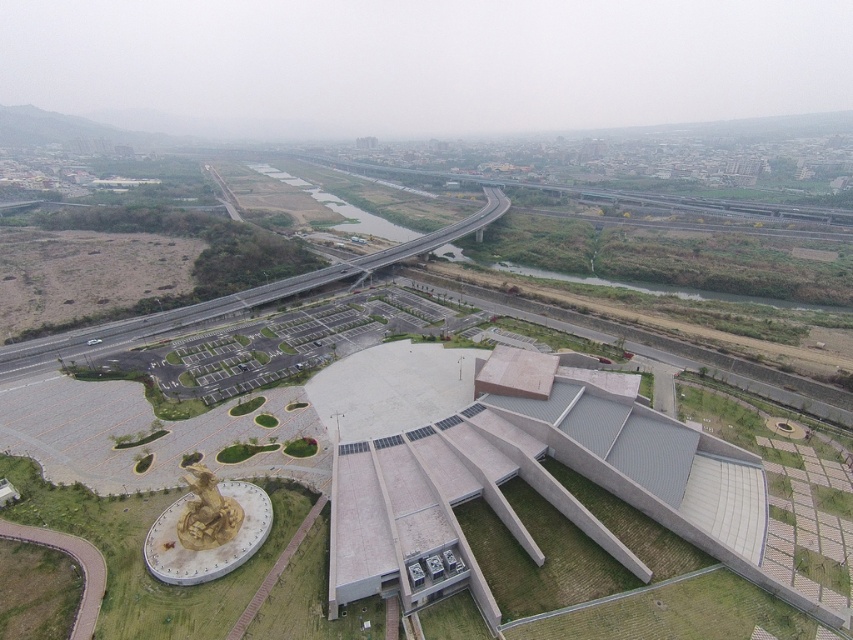
Question: Can you confirm if gray concrete building at center is positioned to the left of gold metallic statue at lower left?

Choices:
 (A) yes
 (B) no

Answer: (B)

Question: Which object appears farthest from the camera in this image?

Choices:
 (A) gray concrete building at center
 (B) gold metallic statue at lower left

Answer: (B)

Question: Does gray concrete building at center have a greater width compared to gold metallic statue at lower left?

Choices:
 (A) yes
 (B) no

Answer: (A)

Question: Can you confirm if gray concrete building at center is smaller than gold metallic statue at lower left?

Choices:
 (A) yes
 (B) no

Answer: (B)

Question: Which of the following is the farthest from the observer?

Choices:
 (A) (163, 568)
 (B) (403, 449)

Answer: (B)